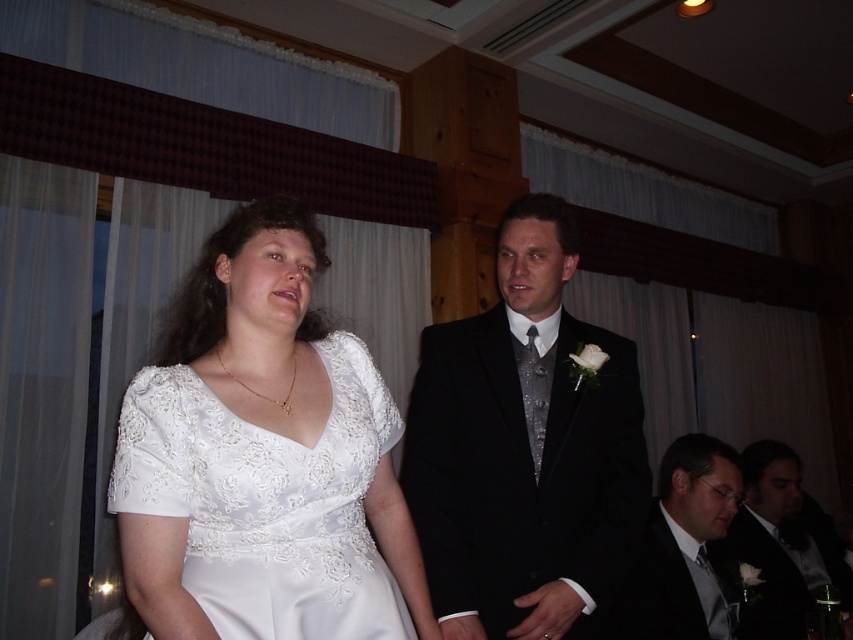
Which is above, black satin suit at center or matte black suit at lower right?

Positioned higher is black satin suit at center.

Is black satin suit at center bigger than matte black suit at lower right?

No, black satin suit at center is not bigger than matte black suit at lower right.

Between point (500, 396) and point (640, 596), which one is positioned in front?

Point (500, 396) is in front.

Where is `black satin suit at center`? black satin suit at center is located at coordinates (525, 449).

Where is `white satin dress at center`? The height and width of the screenshot is (640, 853). white satin dress at center is located at coordinates (258, 435).

Between point (288, 432) and point (407, 460), which one is positioned behind?

The point (407, 460) is behind.

Identify the location of white satin dress at center. The image size is (853, 640). (258, 435).

Does white satin dress at center appear on the right side of matte black suit at lower right?

No, white satin dress at center is not to the right of matte black suit at lower right.

Consider the image. Who is taller, white satin dress at center or matte black suit at lower right?

With more height is white satin dress at center.

Which is behind, point (200, 474) or point (675, 618)?

Point (675, 618)

Identify the location of white satin dress at center. (258, 435).